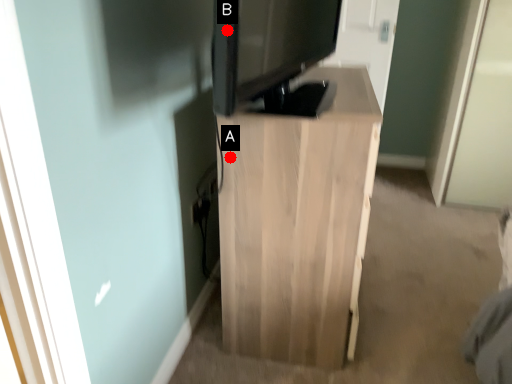
Question: Two points are circled on the image, labeled by A and B beside each circle. Which of the following is the farthest from the observer?

Choices:
 (A) A is further
 (B) B is further

Answer: (A)